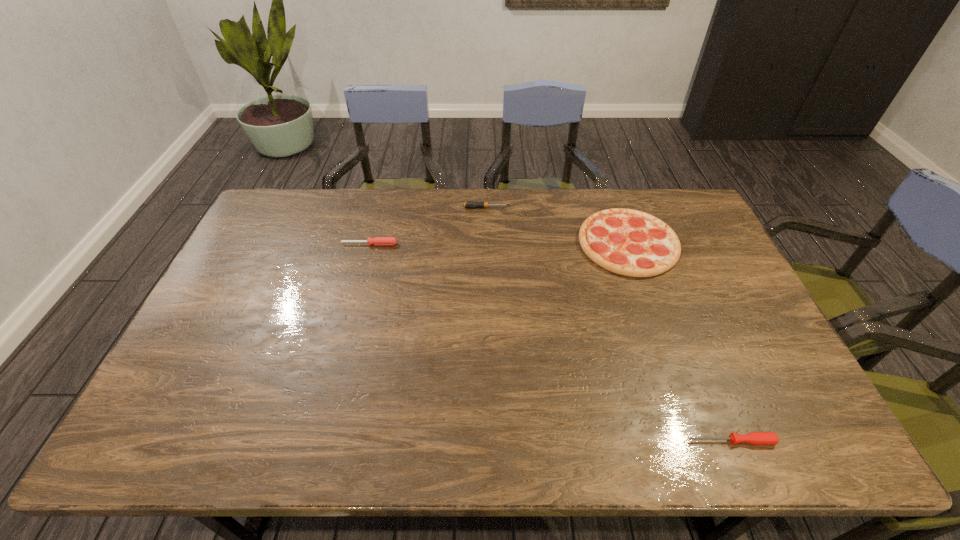
Find the location of a particular element. free space between the second nearest screwdriver and the pizza is located at coordinates (499, 244).

Where is `free space between the nearest screwdriver and the pizza`? free space between the nearest screwdriver and the pizza is located at coordinates (680, 342).

Where is `free space between the nearest screwdriver and the second object from left to right`? This screenshot has height=540, width=960. free space between the nearest screwdriver and the second object from left to right is located at coordinates (609, 325).

Where is `vacant area between the leftmost screwdriver and the farthest object`? vacant area between the leftmost screwdriver and the farthest object is located at coordinates (428, 226).

Locate an element on the screen. vacant point located between the pizza and the nearest object is located at coordinates (680, 342).

The image size is (960, 540). What are the coordinates of `vacant region between the third object from right to left and the leftmost screwdriver` in the screenshot? It's located at (428, 226).

Identify which object is the nearest to the nearest object. Please provide its 2D coordinates. Your answer should be formatted as a tuple, i.e. [(x, y)], where the tuple contains the x and y coordinates of a point satisfying the conditions above.

[(628, 242)]

Choose which object is the third nearest neighbor to the farthest screwdriver. Please provide its 2D coordinates. Your answer should be formatted as a tuple, i.e. [(x, y)], where the tuple contains the x and y coordinates of a point satisfying the conditions above.

[(755, 438)]

Image resolution: width=960 pixels, height=540 pixels. What are the coordinates of `screwdriver object that ranks as the third closest to the pizza` in the screenshot? It's located at (377, 241).

Select which screwdriver is the second closest to the pizza. Please provide its 2D coordinates. Your answer should be formatted as a tuple, i.e. [(x, y)], where the tuple contains the x and y coordinates of a point satisfying the conditions above.

[(755, 438)]